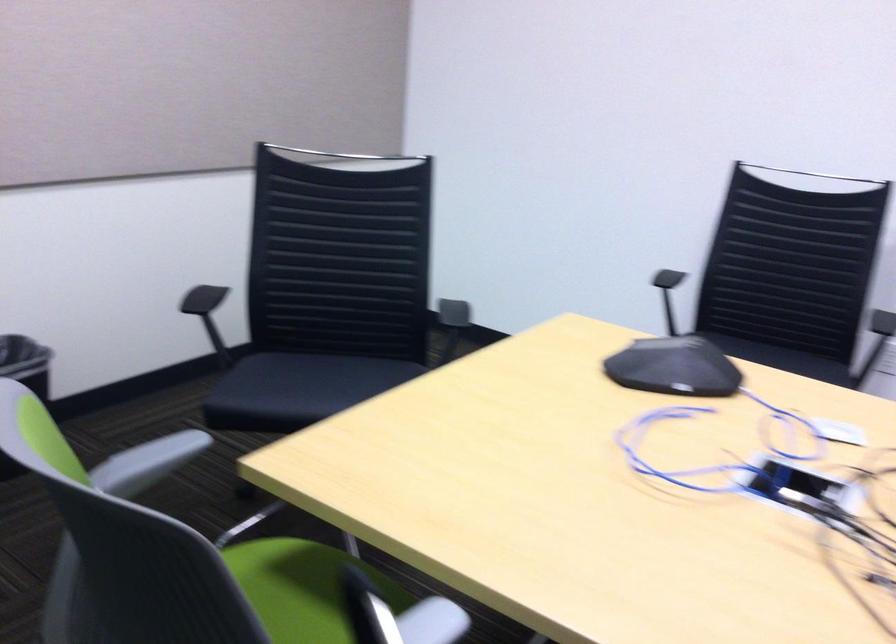
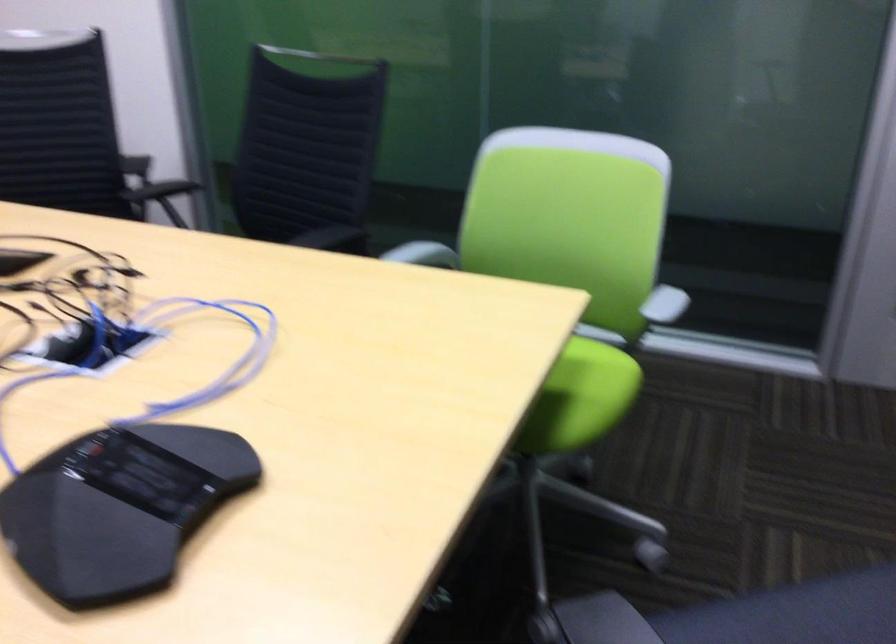
Where in the second image is the point corresponding to [636,336] from the first image?

(119, 507)